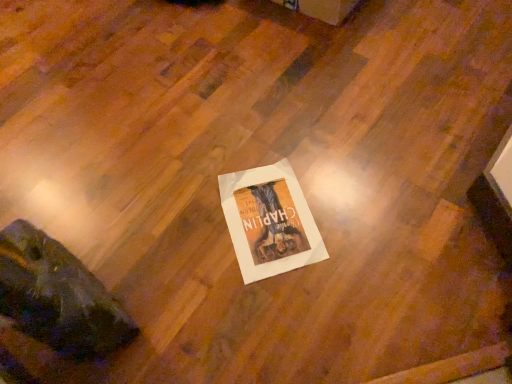
Locate an element on the screen. This screenshot has width=512, height=384. blank space situated above white paper book at center (from a real-world perspective) is located at coordinates (272, 218).